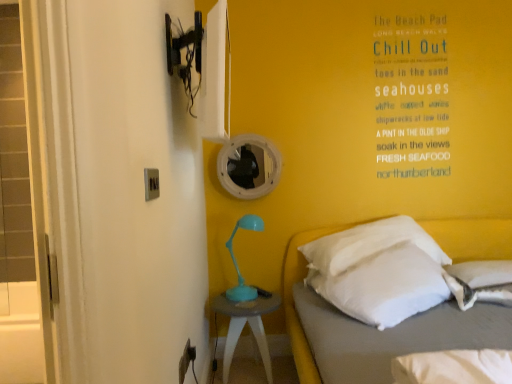
How much space does matte gray electric outlet at lower center, the first electric outlet positioned from the back, occupy horizontally?

It is 1.14 inches.

Measure the distance between point (412, 288) and camera.

The depth of point (412, 288) is 6.38 feet.

Based on the photo, how much space does white soft pillow at right, arranged as the first pillow when viewed from the left, occupy horizontally?

white soft pillow at right, arranged as the first pillow when viewed from the left, is 16.81 inches wide.

What do you see at coordinates (151, 183) in the screenshot? The width and height of the screenshot is (512, 384). I see `matte silver switch at upper left, acting as the first electric outlet starting from the top` at bounding box center [151, 183].

What do you see at coordinates (472, 237) in the screenshot?
I see `white soft bed at lower right` at bounding box center [472, 237].

The image size is (512, 384). What are the coordinates of `matte gray electric outlet at lower center, the first electric outlet positioned from the back` in the screenshot? It's located at (186, 360).

There is a teal plastic nightstand at lower center. Where is `table lamp above it (from a real-world perspective)`? This screenshot has height=384, width=512. table lamp above it (from a real-world perspective) is located at coordinates (236, 261).

How far apart are teal plastic table lamp at center and teal plastic nightstand at lower center?

6.52 inches.

Is teal plastic table lamp at center bigger than teal plastic nightstand at lower center?

No, teal plastic table lamp at center is not bigger than teal plastic nightstand at lower center.

From the picture: Which object is thinner, teal plastic table lamp at center or teal plastic nightstand at lower center?

teal plastic table lamp at center.

From the image's perspective, which one is positioned lower, matte silver switch at upper left, acting as the first electric outlet starting from the top, or white soft bed at lower right?

white soft bed at lower right, from the image's perspective.

Is point (152, 195) less distant than point (298, 277)?

Yes, point (152, 195) is in front of point (298, 277).

Is matte silver switch at upper left, the 1th electric outlet viewed from the front, surrounding white soft bed at lower right?

No.

Which object is positioned more to the right, teal plastic nightstand at lower center or white soft pillow at right, which ranks as the second pillow in right-to-left order?

Positioned to the right is white soft pillow at right, which ranks as the second pillow in right-to-left order.

What's the angular difference between teal plastic nightstand at lower center and white soft pillow at right, which ranks as the second pillow in right-to-left order,'s facing directions?

35.1 degrees.

In terms of width, does teal plastic nightstand at lower center look wider or thinner when compared to white soft pillow at right, which ranks as the second pillow in right-to-left order?

Clearly, teal plastic nightstand at lower center has less width compared to white soft pillow at right, which ranks as the second pillow in right-to-left order.

Locate an element on the screen. The height and width of the screenshot is (384, 512). bed located underneath the matte silver switch at upper left, acting as the second electric outlet starting from the bottom (from a real-world perspective) is located at coordinates (472, 237).

Would you say white soft bed at lower right is outside matte silver switch at upper left, the 1th electric outlet viewed from the front?

white soft bed at lower right is positioned outside matte silver switch at upper left, the 1th electric outlet viewed from the front.

Which object is further away from the camera, white soft bed at lower right or matte silver switch at upper left, acting as the first electric outlet starting from the top?

Positioned behind is matte silver switch at upper left, acting as the first electric outlet starting from the top.

Measure the distance between white soft bed at lower right and matte silver switch at upper left, acting as the first electric outlet starting from the top.

white soft bed at lower right and matte silver switch at upper left, acting as the first electric outlet starting from the top, are 1.41 meters apart from each other.

Is matte silver switch at upper left, acting as the second electric outlet starting from the bottom, bigger or smaller than white soft pillow at right, arranged as the first pillow when viewed from the left?

matte silver switch at upper left, acting as the second electric outlet starting from the bottom, is smaller than white soft pillow at right, arranged as the first pillow when viewed from the left.

In order to click on electric outlet above the white soft pillow at right, which ranks as the second pillow in right-to-left order (from the image's perspective) in this screenshot , I will do `click(151, 183)`.

Is matte silver switch at upper left, the 1th electric outlet viewed from the front, oriented away from white soft pillow at right, arranged as the first pillow when viewed from the left?

No, matte silver switch at upper left, the 1th electric outlet viewed from the front, is not facing away from white soft pillow at right, arranged as the first pillow when viewed from the left.

Could you tell me if white soft pillow at lower right, which ranks as the second pillow in left-to-right order, is facing teal plastic table lamp at center?

No, white soft pillow at lower right, which ranks as the second pillow in left-to-right order, is not facing towards teal plastic table lamp at center.

Who is smaller, white soft pillow at lower right, which ranks as the second pillow in left-to-right order, or teal plastic table lamp at center?

white soft pillow at lower right, which ranks as the second pillow in left-to-right order.

Would you consider white soft pillow at lower right, which is counted as the first pillow, starting from the right, to be distant from teal plastic table lamp at center?

Yes, white soft pillow at lower right, which is counted as the first pillow, starting from the right, is far from teal plastic table lamp at center.

Consider the image. Considering the relative sizes of white soft pillow at lower right, which is counted as the first pillow, starting from the right, and teal plastic table lamp at center in the image provided, is white soft pillow at lower right, which is counted as the first pillow, starting from the right, wider than teal plastic table lamp at center?

Indeed, white soft pillow at lower right, which is counted as the first pillow, starting from the right, has a greater width compared to teal plastic table lamp at center.

In the scene shown: Is white soft pillow at right, arranged as the first pillow when viewed from the left, to the right of white soft bed at lower right from the viewer's perspective?

No.

Is white soft pillow at right, which ranks as the second pillow in right-to-left order, facing away from white soft bed at lower right?

Correct, white soft pillow at right, which ranks as the second pillow in right-to-left order, is looking away from white soft bed at lower right.

Looking at this image, is white soft pillow at right, arranged as the first pillow when viewed from the left, completely or partially outside of white soft bed at lower right?

Actually, white soft pillow at right, arranged as the first pillow when viewed from the left, is within white soft bed at lower right.

From the picture: Which point is more forward, (365, 263) or (307, 359)?

The point (307, 359) is closer.

At what (x,y) coordinates should I click in order to perform the action: click on table lamp located behind the teal plastic nightstand at lower center. Please return your answer as a coordinate pair (x, y). The width and height of the screenshot is (512, 384). Looking at the image, I should click on (236, 261).

Where is `bed on the right of matte silver switch at upper left, acting as the first electric outlet starting from the top`? This screenshot has width=512, height=384. bed on the right of matte silver switch at upper left, acting as the first electric outlet starting from the top is located at coordinates (472, 237).

Estimate the real-world distances between objects in this image. Which object is closer to white soft bed at lower right, white soft pillow at right, which ranks as the second pillow in right-to-left order, or matte silver switch at upper left, the 1th electric outlet viewed from the front?

Based on the image, white soft pillow at right, which ranks as the second pillow in right-to-left order, appears to be nearer to white soft bed at lower right.

Estimate the real-world distances between objects in this image. Which object is further from white soft pillow at lower right, which ranks as the second pillow in left-to-right order, teal plastic nightstand at lower center or teal plastic table lamp at center?

teal plastic table lamp at center.

Which object lies nearer to the anchor point white soft pillow at lower right, which ranks as the second pillow in left-to-right order, teal plastic table lamp at center or teal plastic nightstand at lower center?

teal plastic nightstand at lower center is closer to white soft pillow at lower right, which ranks as the second pillow in left-to-right order.

From the image, which object appears to be farther from white soft pillow at lower right, which is counted as the first pillow, starting from the right, teal plastic nightstand at lower center or matte silver switch at upper left, the 2th electric outlet from the back?

Based on the image, matte silver switch at upper left, the 2th electric outlet from the back, appears to be further to white soft pillow at lower right, which is counted as the first pillow, starting from the right.

Looking at the image, which one is located further to matte silver switch at upper left, acting as the first electric outlet starting from the top, white soft pillow at right, arranged as the first pillow when viewed from the left, or white soft bed at lower right?

Among the two, white soft bed at lower right is located further to matte silver switch at upper left, acting as the first electric outlet starting from the top.

Which object lies nearer to the anchor point teal plastic table lamp at center, matte silver switch at upper left, the 1th electric outlet viewed from the front, or matte gray electric outlet at lower center, the 2th electric outlet from the top?

The object closer to teal plastic table lamp at center is matte gray electric outlet at lower center, the 2th electric outlet from the top.

Which object lies further to the anchor point matte silver switch at upper left, the 1th electric outlet viewed from the front, white soft bed at lower right or white soft pillow at right, which ranks as the second pillow in right-to-left order?

Among the two, white soft bed at lower right is located further to matte silver switch at upper left, the 1th electric outlet viewed from the front.

Based on their spatial positions, is white soft pillow at right, which ranks as the second pillow in right-to-left order, or matte gray electric outlet at lower center, the first electric outlet positioned from the back, closer to teal plastic table lamp at center?

white soft pillow at right, which ranks as the second pillow in right-to-left order, is positioned closer to the anchor teal plastic table lamp at center.

Image resolution: width=512 pixels, height=384 pixels. Find the location of `table lamp between matte gray electric outlet at lower center, the first electric outlet when ordered from bottom to top, and white soft pillow at right, arranged as the first pillow when viewed from the left, in the horizontal direction`. table lamp between matte gray electric outlet at lower center, the first electric outlet when ordered from bottom to top, and white soft pillow at right, arranged as the first pillow when viewed from the left, in the horizontal direction is located at coordinates (236, 261).

Find the location of `pillow between matte silver switch at upper left, acting as the second electric outlet starting from the bottom, and white soft bed at lower right, in the horizontal direction`. pillow between matte silver switch at upper left, acting as the second electric outlet starting from the bottom, and white soft bed at lower right, in the horizontal direction is located at coordinates (385, 286).

Where is `electric outlet located between matte silver switch at upper left, acting as the second electric outlet starting from the bottom, and white soft bed at lower right in the left-right direction`? This screenshot has width=512, height=384. electric outlet located between matte silver switch at upper left, acting as the second electric outlet starting from the bottom, and white soft bed at lower right in the left-right direction is located at coordinates (186, 360).

Find the location of a particular element. electric outlet located between matte silver switch at upper left, the 2th electric outlet from the back, and white soft pillow at right, arranged as the first pillow when viewed from the left, in the left-right direction is located at coordinates (186, 360).